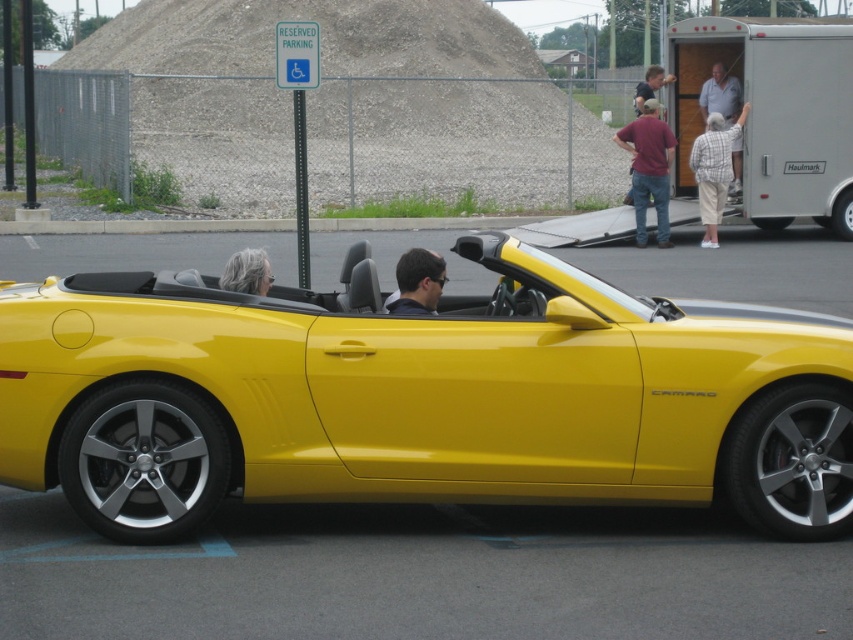
You are a delivery person trying to park your delivery van in the parking lot. You see the shiny yellow convertible at center and gray hair at center. Is there enough space between them to fit your van, which is 2 meters wide?

The shiny yellow convertible at center is 1.65 meters from gray hair at center. Since the distance between them is less than the van width of 2 meters, the van cannot fit between them.

You are a delivery person trying to park your 6.5 feet tall delivery van in the parking lot. You see the shiny yellow convertible at center and the plaid shirt at upper right. Can your van fit vertically between them?

The shiny yellow convertible at center is taller than the plaid shirt at upper right. Since the van is 6.5 feet tall, and the convertible is taller than the shirt, the van may not fit if the convertible is taller than 6.5 feet. However, without knowing the exact height of the convertible, it is uncertain. Please check the actual height of the shiny yellow convertible at center before deciding.

You are a delivery person trying to park your van in the parking lot. You see the shiny yellow convertible at center and the gray hair at center. Which object takes up more space in the parking lot?

The shiny yellow convertible at center is larger in size than the gray hair at center, so the shiny yellow convertible at center takes up more space in the parking lot.